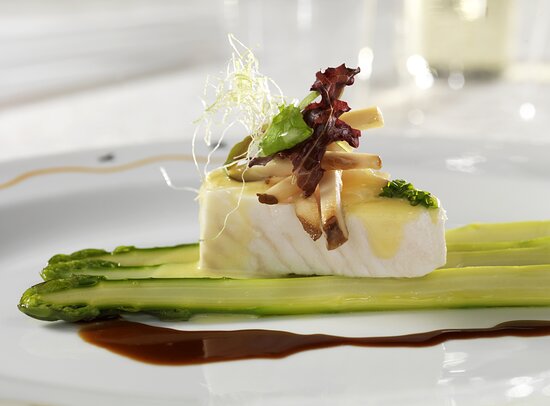
The image size is (550, 406). What are the coordinates of `plate` in the screenshot? It's located at (80, 233).